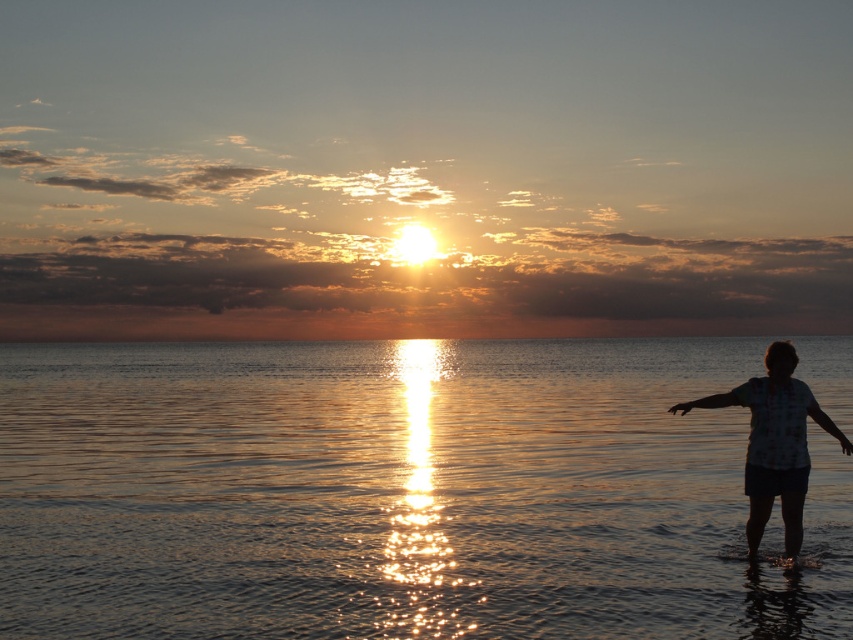
You are a photographer trying to capture the sunset scene. You notice the glistening water at center and the silhouette fabric at right in your viewfinder. Which object should you focus on if you want to highlight the larger element in the frame?

The glistening water at center is bigger than the silhouette fabric at right, so you should focus on the glistening water at center to highlight the larger element in the frame.